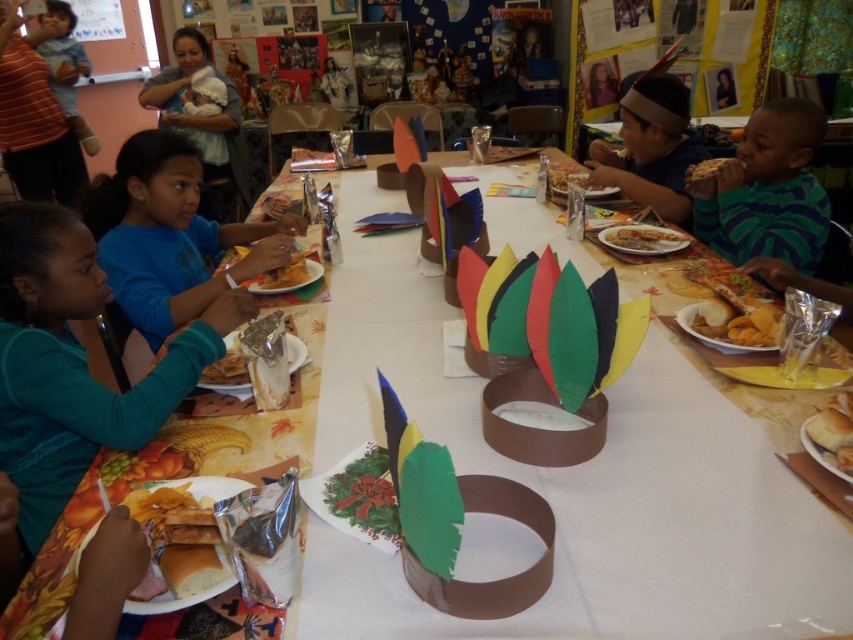
You are a teacher trying to distribute snacks to students. You have a brown paper plate at center with limited space. If you want to place a matte blue shirt at upper left on the plate, will it fit?

The matte blue shirt at upper left might be wider than brown paper plate at center, so it may not fit on the plate.

Consider the image. You are a teacher standing at the front of the classroom. You need to hand out a snack to the student wearing the matte blue shirt at upper left. The snacks are on the brown paper plate at center. Can you reach the student without moving from your current position?

The matte blue shirt at upper left is 3.93 meters away from the brown paper plate at center. Since the distance is over 3 meters, you cannot reach the student without moving closer.